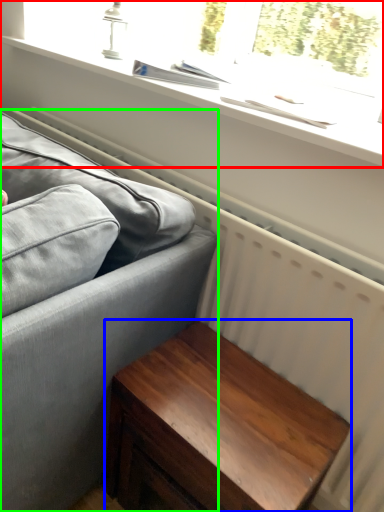
Question: Which object is positioned farthest from window (highlighted by a red box)? Select from table (highlighted by a blue box) and studio couch (highlighted by a green box).

Choices:
 (A) table
 (B) studio couch

Answer: (A)